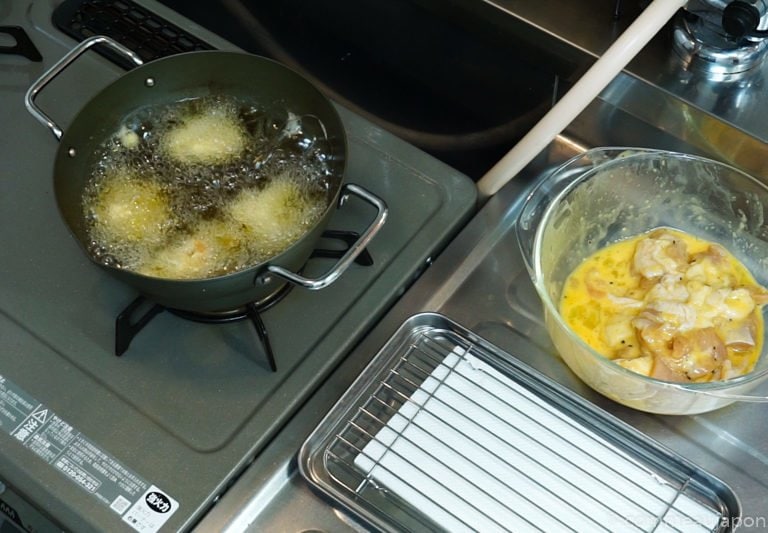
This screenshot has width=768, height=533. Identify the location of label on stovetop. (91, 473).